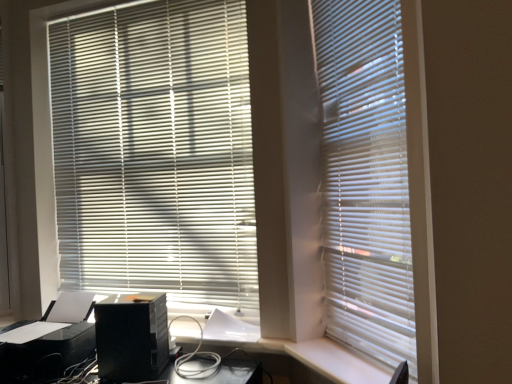
The width and height of the screenshot is (512, 384). Describe the element at coordinates (3, 212) in the screenshot. I see `white plastic screen door at left` at that location.

At what (x,y) coordinates should I click in order to perform the action: click on white matte blinds at center, the 2th window blind from the left. Please return your answer as a coordinate pair (x, y). The height and width of the screenshot is (384, 512). Looking at the image, I should click on (366, 179).

From a real-world perspective, is white matte blinds at center, placed as the 2th window blind when sorted from front to back, above or below black plastic printer at lower left?

From a real-world perspective, white matte blinds at center, placed as the 2th window blind when sorted from front to back, is physically above black plastic printer at lower left.

Image resolution: width=512 pixels, height=384 pixels. What are the coordinates of `printer in front of the white matte blinds at center, the first window blind in the left-to-right sequence` in the screenshot? It's located at (49, 341).

Is white matte blinds at center, which appears as the second window blind when viewed from the right, smaller than black plastic printer at lower left?

Indeed, white matte blinds at center, which appears as the second window blind when viewed from the right, has a smaller size compared to black plastic printer at lower left.

Which is less distant, (135, 109) or (15, 346)?

The point (15, 346) is more forward.

Is white matte blinds at center, the 1th window blind when ordered from front to back, smaller than white plastic screen door at left?

Actually, white matte blinds at center, the 1th window blind when ordered from front to back, might be larger than white plastic screen door at left.

Is white matte blinds at center, which is the 1th window blind from right to left, directly adjacent to white plastic screen door at left?

No.

Which of these two, white matte blinds at center, the 2th window blind from the left, or white plastic screen door at left, is wider?

white plastic screen door at left is wider.

From the image's perspective, which one is positioned lower, white matte blinds at center, the 1th window blind when ordered from front to back, or white plastic screen door at left?

From the image's view, white matte blinds at center, the 1th window blind when ordered from front to back, is below.

Considering the relative positions of black plastic computer tower at lower left and white matte blinds at center, placed as the 2th window blind when sorted from front to back, in the image provided, is black plastic computer tower at lower left to the left of white matte blinds at center, placed as the 2th window blind when sorted from front to back, from the viewer's perspective?

Incorrect, black plastic computer tower at lower left is not on the left side of white matte blinds at center, placed as the 2th window blind when sorted from front to back.

Between black plastic computer tower at lower left and white matte blinds at center, the 1th window blind from the back, which one has larger size?

With larger size is white matte blinds at center, the 1th window blind from the back.

Is black plastic computer tower at lower left placed right next to white matte blinds at center, placed as the 2th window blind when sorted from front to back?

No, black plastic computer tower at lower left is not with white matte blinds at center, placed as the 2th window blind when sorted from front to back.

Can you confirm if black plastic computer tower at lower left is taller than white matte blinds at center, the 1th window blind from the back?

In fact, black plastic computer tower at lower left may be shorter than white matte blinds at center, the 1th window blind from the back.

Considering the sizes of objects white matte blinds at center, the first window blind in the left-to-right sequence, and white matte blinds at center, positioned as the second window blind in back-to-front order, in the image provided, who is wider, white matte blinds at center, the first window blind in the left-to-right sequence, or white matte blinds at center, positioned as the second window blind in back-to-front order,?

white matte blinds at center, the first window blind in the left-to-right sequence.

Which of these two, white matte blinds at center, the first window blind in the left-to-right sequence, or white matte blinds at center, which is the 1th window blind from right to left, stands taller?

white matte blinds at center, the first window blind in the left-to-right sequence.

Would you say white matte blinds at center, which appears as the second window blind when viewed from the right, contains white matte blinds at center, the 2th window blind from the left?

No, white matte blinds at center, the 2th window blind from the left, is not a part of white matte blinds at center, which appears as the second window blind when viewed from the right.

Relative to black plastic computer tower at lower left, is black plastic printer at lower left in front or behind?

Visually, black plastic printer at lower left is located behind black plastic computer tower at lower left.

Looking at this image, from the image's perspective, is black plastic printer at lower left located above or below black plastic computer tower at lower left?

Based on their image positions, black plastic printer at lower left is located beneath black plastic computer tower at lower left.

Between black plastic printer at lower left and black plastic computer tower at lower left, which one appears on the right side from the viewer's perspective?

black plastic computer tower at lower left is more to the right.

In the scene shown: In terms of size, does black plastic printer at lower left appear bigger or smaller than black plastic computer tower at lower left?

Considering their sizes, black plastic printer at lower left takes up more space than black plastic computer tower at lower left.

From the image's perspective, who appears lower, black plastic printer at lower left or white matte blinds at center, positioned as the second window blind in back-to-front order?

black plastic printer at lower left.

Considering the relative positions of black plastic printer at lower left and white matte blinds at center, the 2th window blind from the left, in the image provided, is black plastic printer at lower left to the left of white matte blinds at center, the 2th window blind from the left, from the viewer's perspective?

Yes, black plastic printer at lower left is to the left of white matte blinds at center, the 2th window blind from the left.

How much distance is there between white matte blinds at center, the 1th window blind when ordered from front to back, and black plastic printer at lower left?

4.41 feet.

Who is shorter, white matte blinds at center, the 1th window blind when ordered from front to back, or black plastic printer at lower left?

black plastic printer at lower left.

Between white matte blinds at center, positioned as the second window blind in back-to-front order, and black plastic printer at lower left, which one appears on the left side from the viewer's perspective?

From the viewer's perspective, black plastic printer at lower left appears more on the left side.

Is the position of white matte blinds at center, the 1th window blind when ordered from front to back, less distant than that of black plastic printer at lower left?

Yes, it is in front of black plastic printer at lower left.

Find the location of `the 2nd window blind above when counting from the black plastic printer at lower left (from the image's perspective)`. the 2nd window blind above when counting from the black plastic printer at lower left (from the image's perspective) is located at coordinates (155, 151).

Locate an element on the screen. The height and width of the screenshot is (384, 512). screen door lying on the left of white matte blinds at center, the 1th window blind when ordered from front to back is located at coordinates (3, 212).

Which object lies further to the anchor point white plastic screen door at left, black plastic printer at lower left or white matte blinds at center, which appears as the second window blind when viewed from the right?

Among the two, white matte blinds at center, which appears as the second window blind when viewed from the right, is located further to white plastic screen door at left.

From the image, which object appears to be farther from white matte blinds at center, placed as the 2th window blind when sorted from front to back, black plastic computer tower at lower left or white matte blinds at center, which is the 1th window blind from right to left?

white matte blinds at center, which is the 1th window blind from right to left, is positioned further to the anchor white matte blinds at center, placed as the 2th window blind when sorted from front to back.

Which object lies nearer to the anchor point black plastic computer tower at lower left, black plastic printer at lower left or white plastic screen door at left?

black plastic printer at lower left.

Looking at this image, looking at the image, which one is located closer to white plastic screen door at left, black plastic computer tower at lower left or black plastic printer at lower left?

black plastic printer at lower left lies closer to white plastic screen door at left than the other object.

Based on their spatial positions, is white plastic screen door at left or white matte blinds at center, which appears as the second window blind when viewed from the right, closer to white matte blinds at center, positioned as the second window blind in back-to-front order?

white matte blinds at center, which appears as the second window blind when viewed from the right, is closer to white matte blinds at center, positioned as the second window blind in back-to-front order.

Which object lies nearer to the anchor point white matte blinds at center, placed as the 2th window blind when sorted from front to back, white plastic screen door at left or white matte blinds at center, positioned as the second window blind in back-to-front order?

Among the two, white plastic screen door at left is located nearer to white matte blinds at center, placed as the 2th window blind when sorted from front to back.

From the image, which object appears to be farther from white matte blinds at center, the 1th window blind when ordered from front to back, black plastic printer at lower left or white plastic screen door at left?

Based on the image, white plastic screen door at left appears to be further to white matte blinds at center, the 1th window blind when ordered from front to back.

When comparing their distances from white matte blinds at center, which appears as the second window blind when viewed from the right, does white matte blinds at center, the 2th window blind from the left, or black plastic computer tower at lower left seem closer?

Among the two, black plastic computer tower at lower left is located nearer to white matte blinds at center, which appears as the second window blind when viewed from the right.

Locate an element on the screen. The width and height of the screenshot is (512, 384). window blind situated between white plastic screen door at left and black plastic computer tower at lower left from left to right is located at coordinates (155, 151).

The width and height of the screenshot is (512, 384). I want to click on computer tower located between black plastic printer at lower left and white matte blinds at center, which is the 1th window blind from right to left, in the left-right direction, so click(x=131, y=337).

This screenshot has width=512, height=384. I want to click on screen door between white matte blinds at center, placed as the 2th window blind when sorted from front to back, and black plastic printer at lower left, in the vertical direction, so click(x=3, y=212).

At what (x,y) coordinates should I click in order to perform the action: click on computer tower between white matte blinds at center, which appears as the second window blind when viewed from the right, and white matte blinds at center, the 1th window blind when ordered from front to back, from left to right. Please return your answer as a coordinate pair (x, y). Looking at the image, I should click on (131, 337).